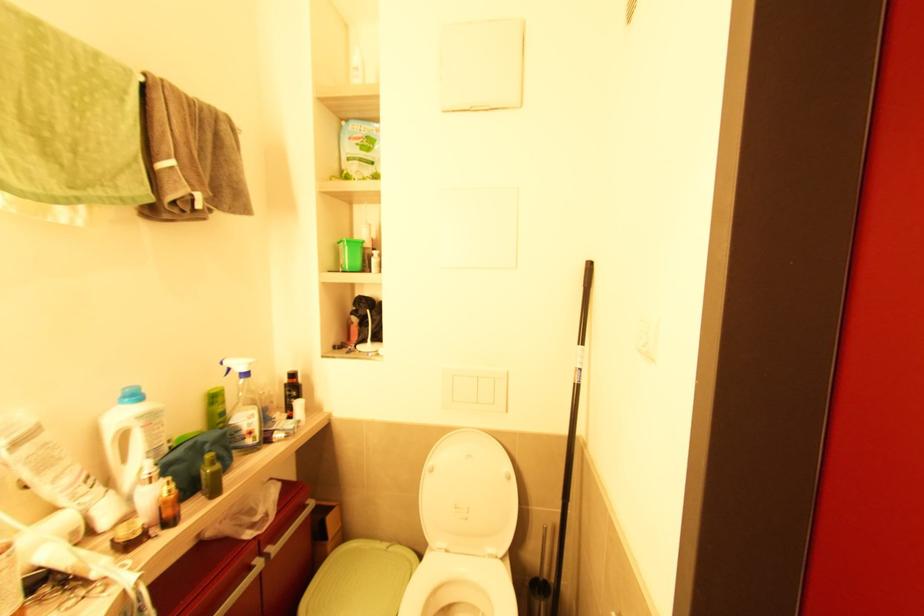
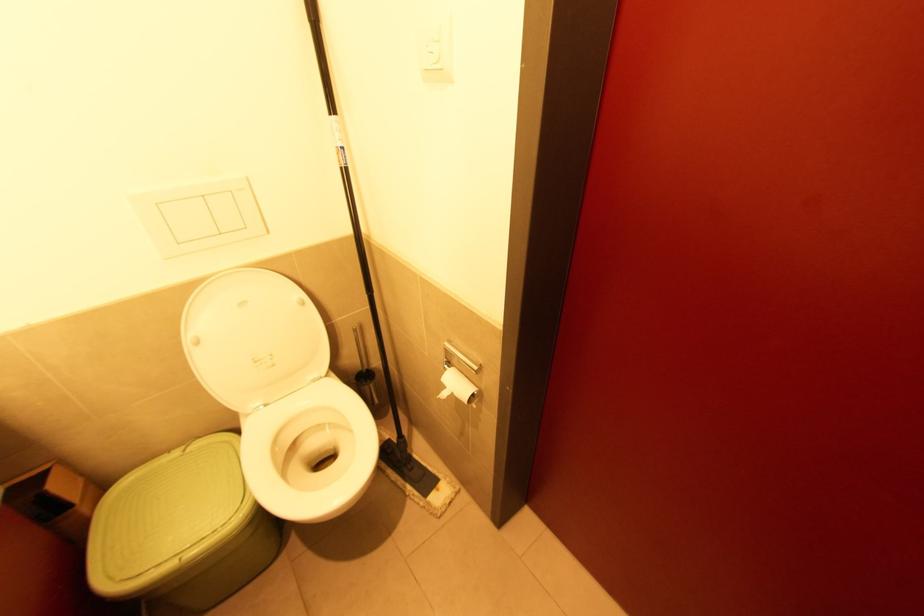
Locate, in the second image, the point that corresponds to (533,578) in the first image.

(358, 374)